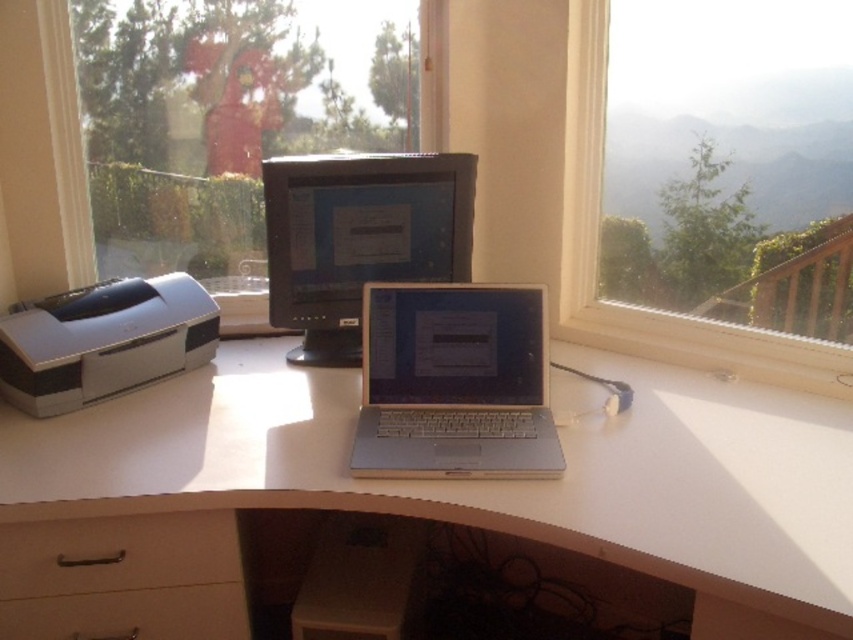
Does transparent glass window at upper right appear under brown matte drawer at lower left?

No, transparent glass window at upper right is not below brown matte drawer at lower left.

Does transparent glass window at upper right have a lesser width compared to brown matte drawer at lower left?

No.

The width and height of the screenshot is (853, 640). Find the location of `transparent glass window at upper right`. transparent glass window at upper right is located at coordinates (643, 307).

Who is shorter, silver metallic laptop at center or white matte drawer at lower left?

white matte drawer at lower left

Who is positioned more to the left, silver metallic laptop at center or white matte drawer at lower left?

From the viewer's perspective, white matte drawer at lower left appears more on the left side.

Does point (505, 420) lie behind point (106, 624)?

Yes, point (505, 420) is farther from viewer.

Image resolution: width=853 pixels, height=640 pixels. I want to click on silver metallic laptop at center, so click(x=454, y=381).

Can you confirm if silver metallic laptop at center is wider than transparent glass window at upper right?

No.

Who is taller, silver metallic laptop at center or transparent glass window at upper right?

transparent glass window at upper right

At what (x,y) coordinates should I click in order to perform the action: click on silver metallic laptop at center. Please return your answer as a coordinate pair (x, y). Image resolution: width=853 pixels, height=640 pixels. Looking at the image, I should click on (454, 381).

This screenshot has height=640, width=853. Identify the location of silver metallic laptop at center. (454, 381).